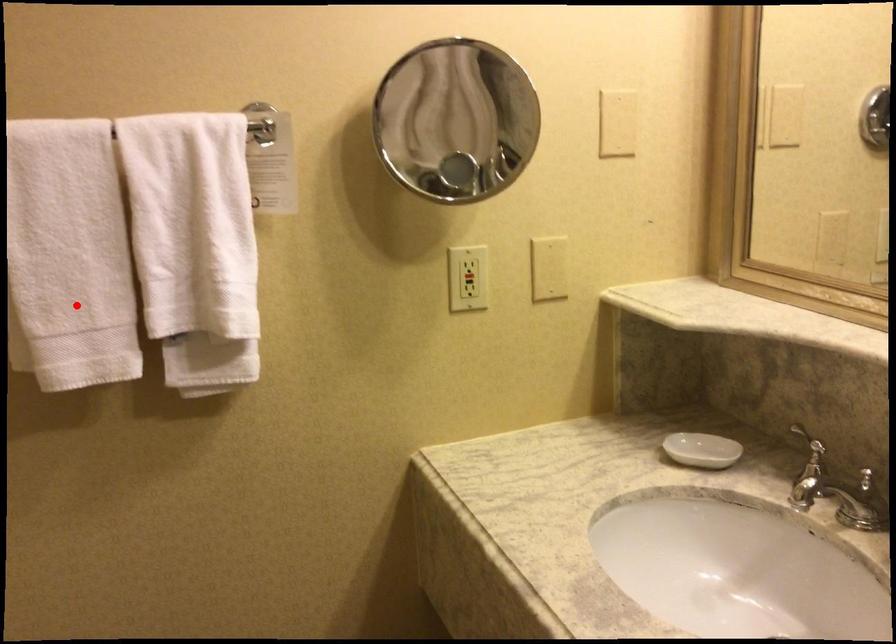
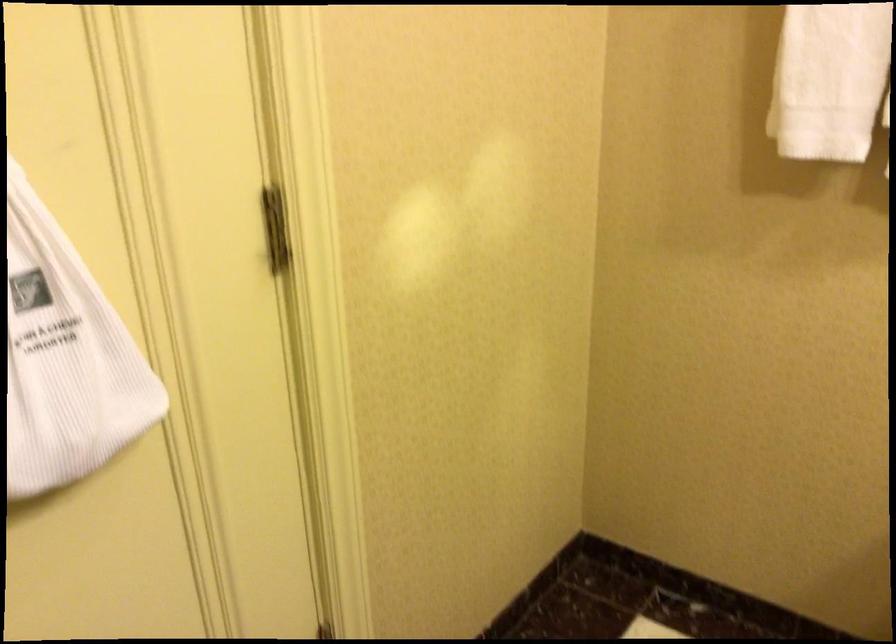
Question: I am providing you with two images of the same scene from different viewpoints. A red point is shown in image1. For the corresponding object point in image2, is it positioned nearer or farther from the camera?

Choices:
 (A) Nearer
 (B) Farther

Answer: (B)